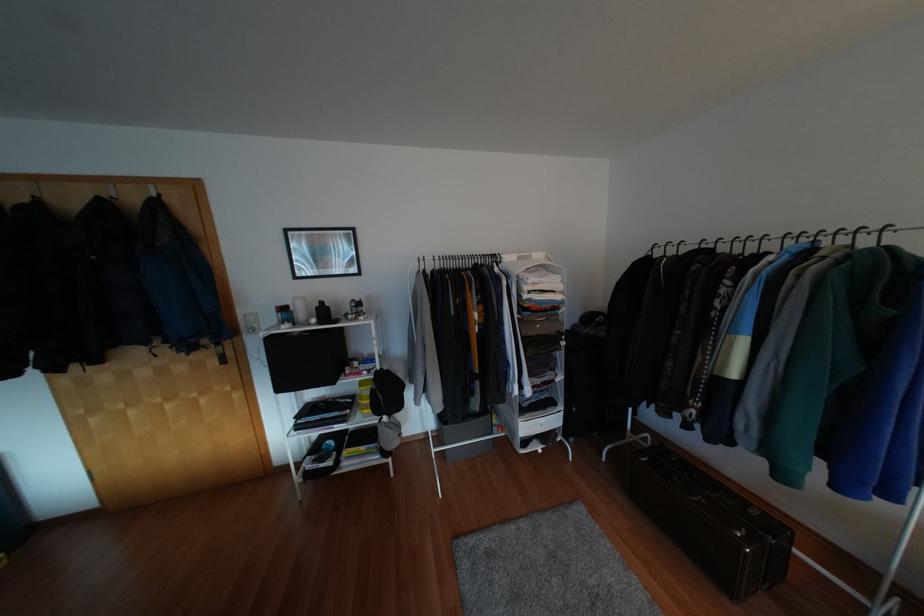
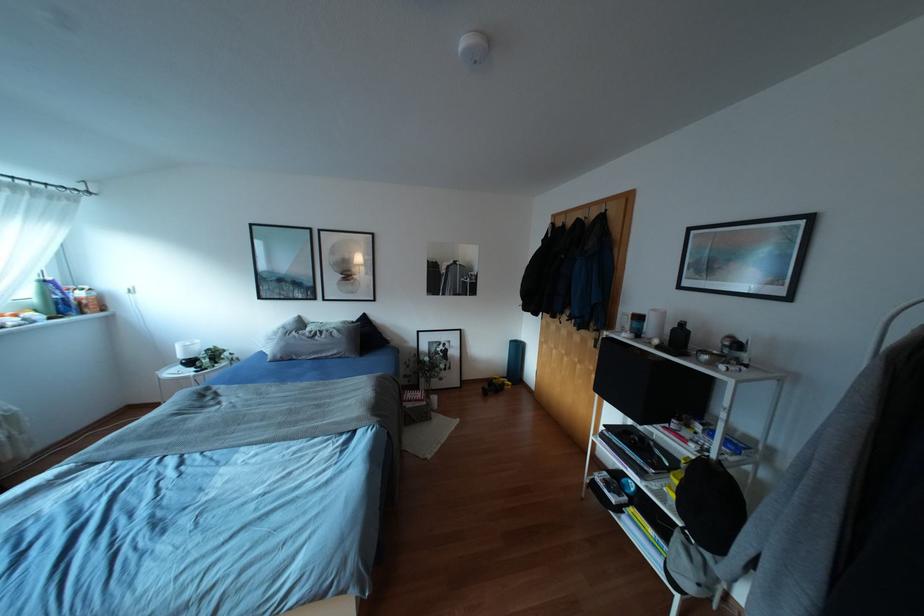
The point at (321,302) is marked in the first image. Where is the corresponding point in the second image?

(682, 323)